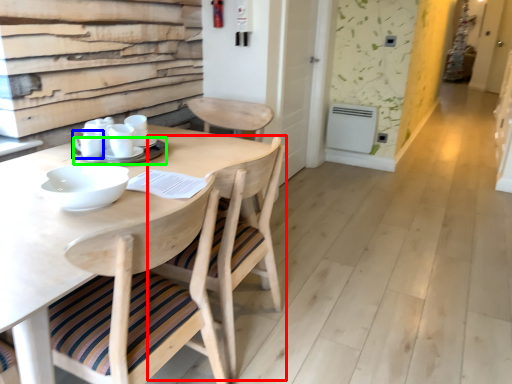
Question: Which object is positioned farthest from chair (highlighted by a red box)? Select from tableware (highlighted by a blue box) and tableware (highlighted by a green box).

Choices:
 (A) tableware
 (B) tableware

Answer: (A)